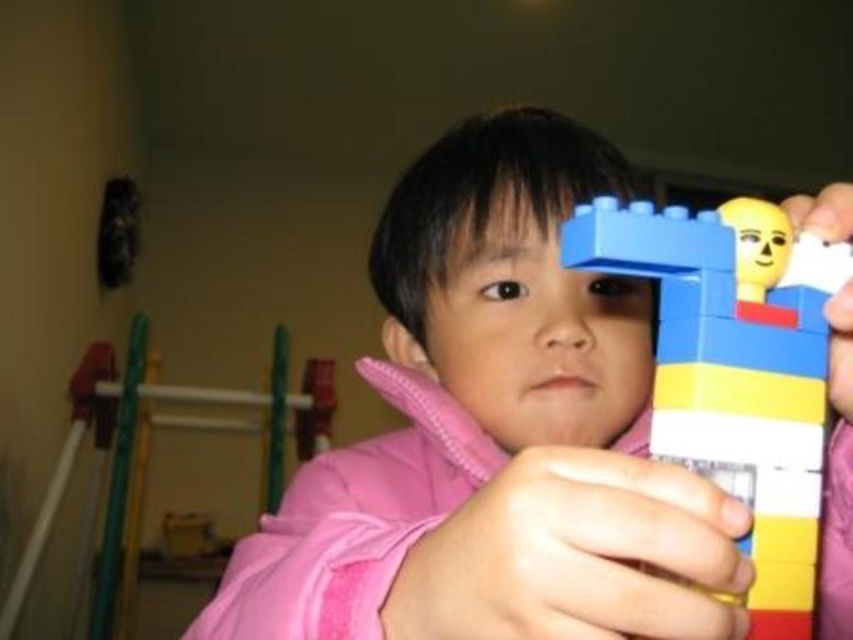
From the picture: Which is below, matte plastic toy at center or brick-like plastic toy at upper right?

matte plastic toy at center is lower down.

In the scene shown: Which is more to the left, matte plastic toy at center or brick-like plastic toy at upper right?

matte plastic toy at center

In order to click on matte plastic toy at center in this screenshot , I will do coord(494,433).